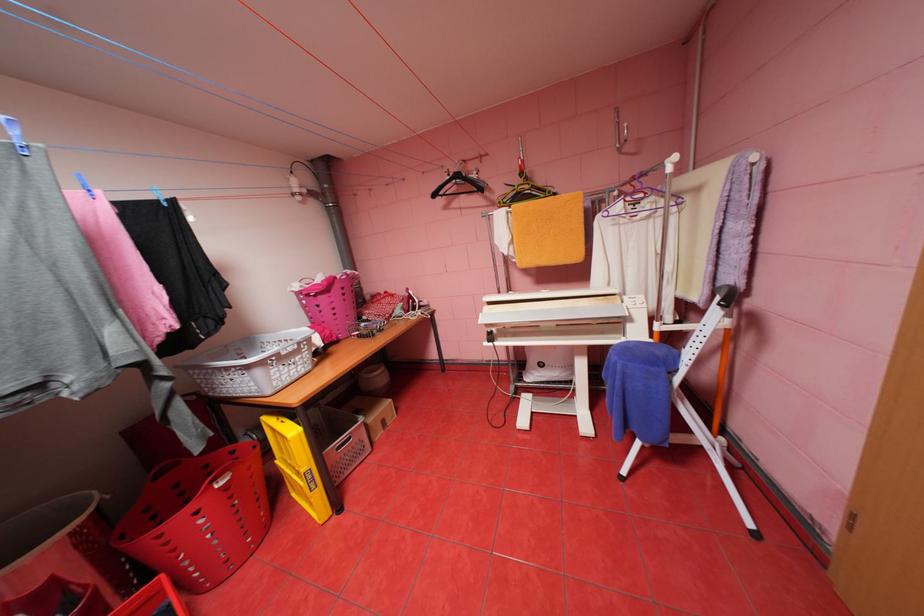
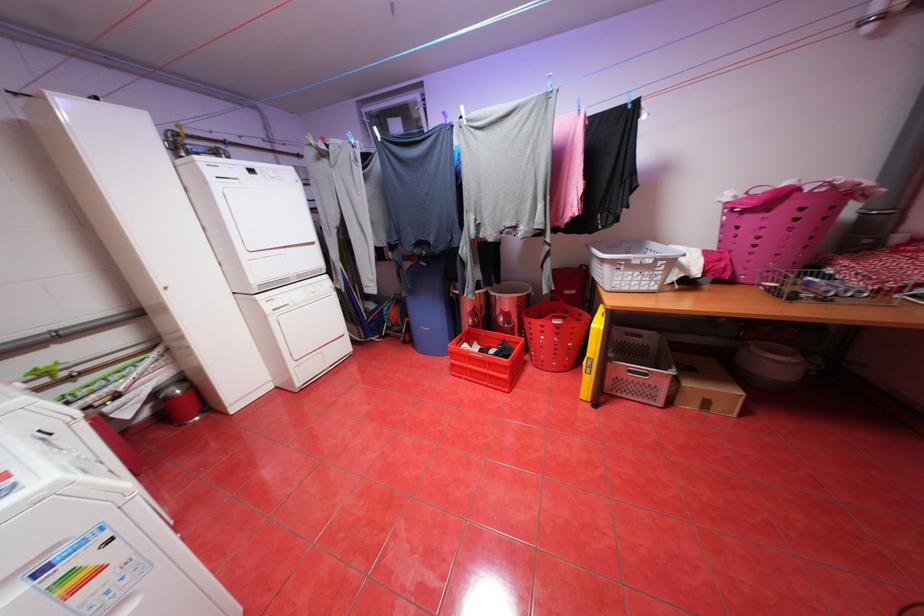
Where in the second image is the point corresponding to [354,273] from the first image?

(839, 183)